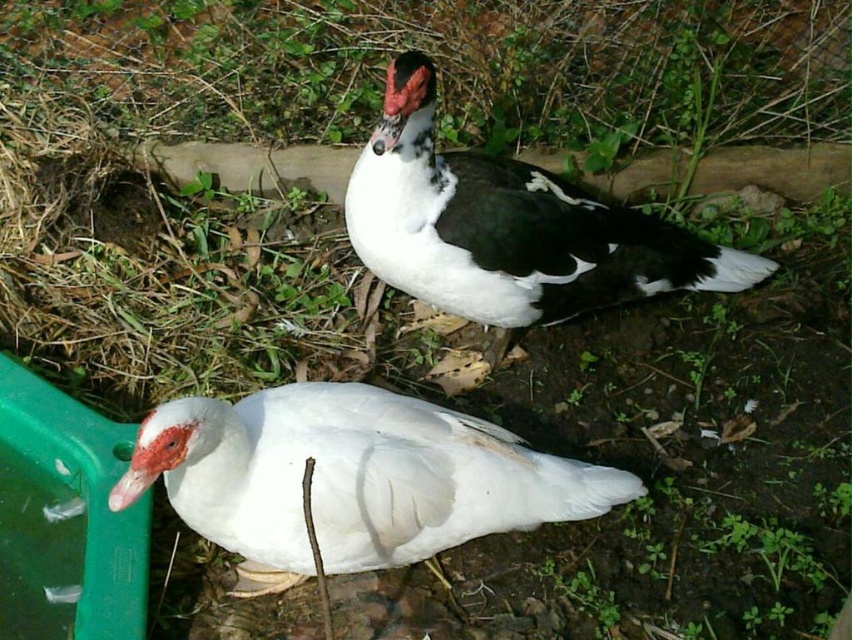
Question: Does white matte duck at lower left lie in front of white matte duck at center?

Choices:
 (A) yes
 (B) no

Answer: (A)

Question: Does white matte duck at lower left come in front of white matte duck at center?

Choices:
 (A) yes
 (B) no

Answer: (A)

Question: Which object appears closest to the camera in this image?

Choices:
 (A) white matte duck at center
 (B) white matte duck at lower left

Answer: (B)

Question: Does white matte duck at lower left have a smaller size compared to white matte duck at center?

Choices:
 (A) no
 (B) yes

Answer: (B)

Question: Among these objects, which one is farthest from the camera?

Choices:
 (A) white matte duck at lower left
 (B) white matte duck at center

Answer: (B)

Question: Among these objects, which one is farthest from the camera?

Choices:
 (A) white matte duck at lower left
 (B) white matte duck at center

Answer: (B)